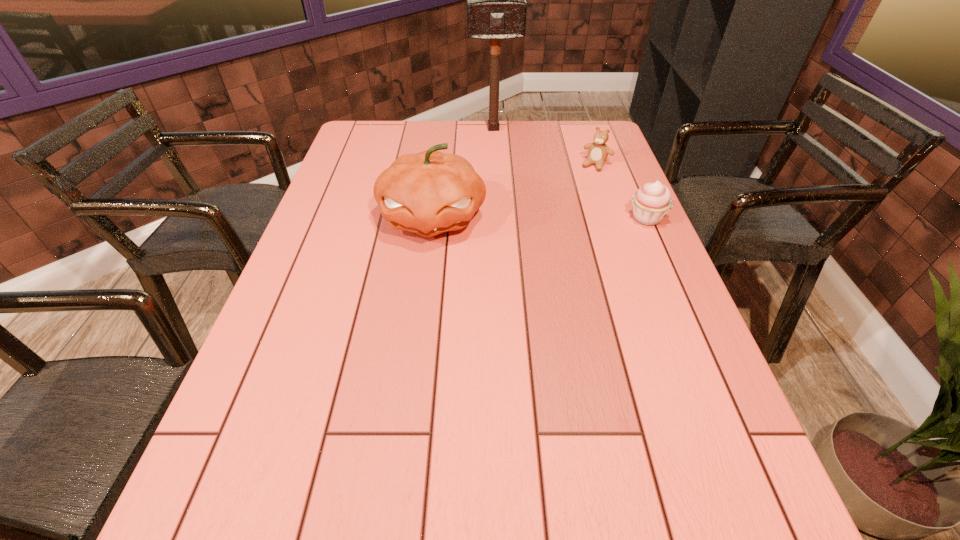
The image size is (960, 540). I want to click on the second closest object to the tallest object, so pos(427,193).

The height and width of the screenshot is (540, 960). I want to click on the closest object to the mallet, so click(598, 152).

Locate an element on the screen. free space that satisfies the following two spatial constraints: 1. on the front face of the cupcake; 2. on the right side of the second tallest object is located at coordinates (432, 218).

Image resolution: width=960 pixels, height=540 pixels. Identify the location of free space that satisfies the following two spatial constraints: 1. on the front face of the cupcake; 2. on the right side of the pumpkin. (432, 218).

Find the location of a particular element. Image resolution: width=960 pixels, height=540 pixels. free point that satisfies the following two spatial constraints: 1. on the front face of the third shortest object; 2. on the left side of the cupcake is located at coordinates (432, 218).